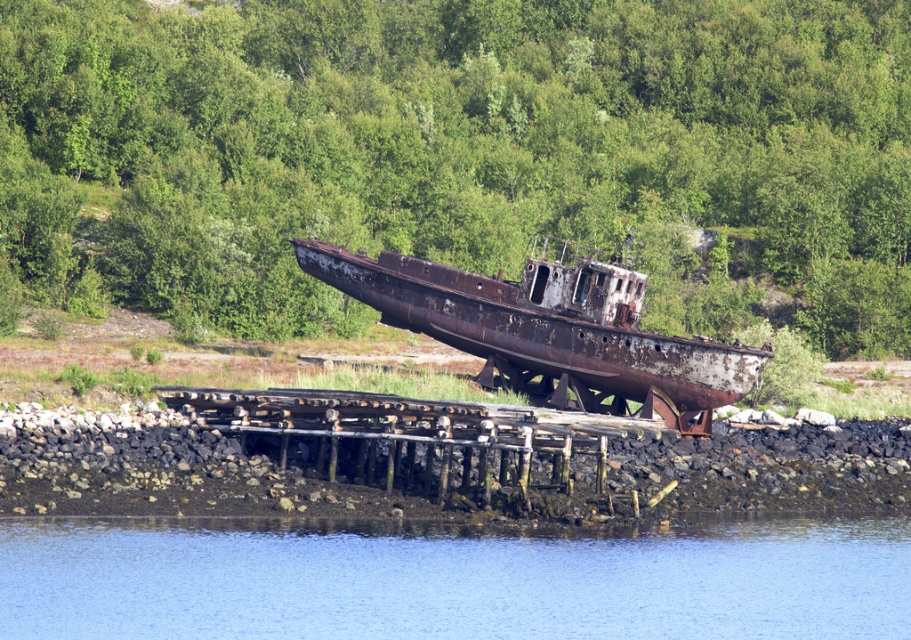
You are standing at the wooden pier and want to take a photo of the ship. You notice two points marked on your map as point 1 and point 2. Point 1 is at coordinates point (878,70) and point 2 is at point (559,371). Which point is closer to you when you are at the pier?

Point (878,70) is further to the camera than point (559,371), so point (559,371) is closer to you.

You are standing at the point marked by the coordinates point [453,580] in the image. What would you see directly below you?

The blue water at lower center is represented by point [453,580], so you would see blue water directly below you.